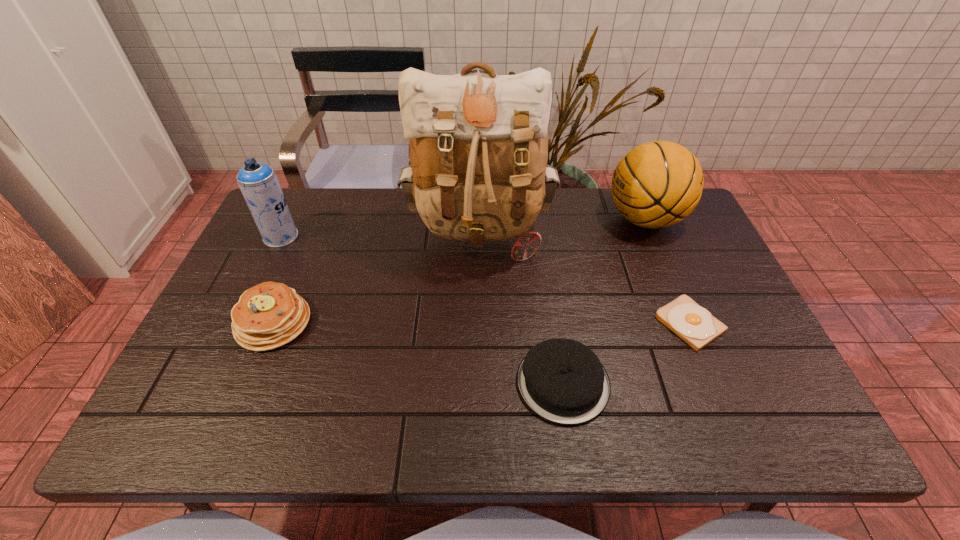
Identify the location of object that is the second closest one to the tallest object. The height and width of the screenshot is (540, 960). (269, 315).

Image resolution: width=960 pixels, height=540 pixels. I want to click on object that is the fourth closest to the right pancake, so click(269, 315).

Locate an element on the screen. The width and height of the screenshot is (960, 540). vacant space that satisfies the following two spatial constraints: 1. on the front-facing side of the shorter pancake; 2. on the right side of the tallest object is located at coordinates (479, 383).

I want to click on vacant space that satisfies the following two spatial constraints: 1. on the front-facing side of the backpack; 2. on the left side of the right pancake, so tap(479, 383).